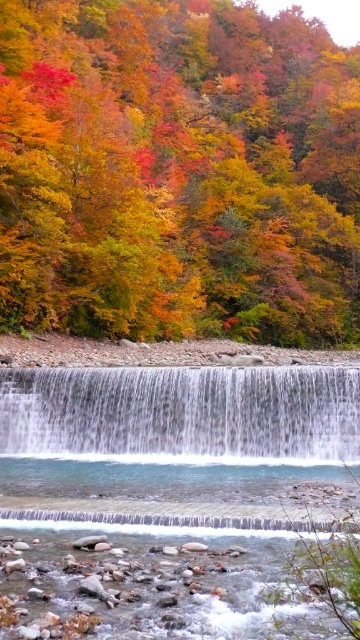
Question: Is white smooth waterfall at center thinner than clear water at center?

Choices:
 (A) no
 (B) yes

Answer: (A)

Question: Is white smooth waterfall at center to the right of clear water at center from the viewer's perspective?

Choices:
 (A) yes
 (B) no

Answer: (B)

Question: Is multicolored autumn leaves at upper center to the left of clear water at center from the viewer's perspective?

Choices:
 (A) no
 (B) yes

Answer: (A)

Question: Which of the following is the closest to the observer?

Choices:
 (A) multicolored autumn leaves at upper center
 (B) white smooth waterfall at center

Answer: (B)

Question: Which point is farther to the camera?

Choices:
 (A) clear water at center
 (B) white smooth waterfall at center
 (C) clear glass waterfall at center
 (D) multicolored autumn leaves at upper center

Answer: (D)

Question: Which point is closer to the camera?

Choices:
 (A) multicolored autumn leaves at upper center
 (B) clear water at center

Answer: (B)